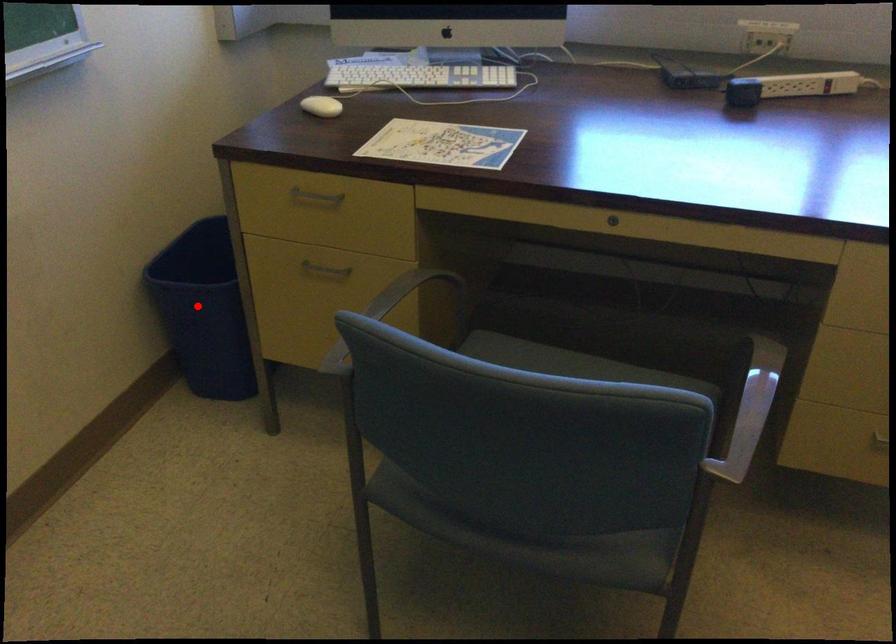
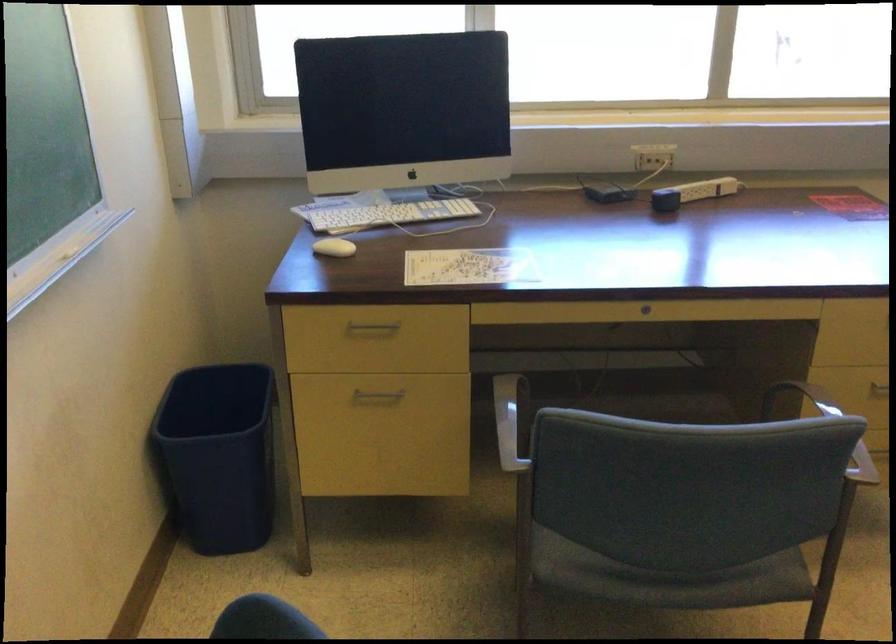
Locate, in the second image, the point that corresponds to the highlighted location in the first image.

(217, 456)